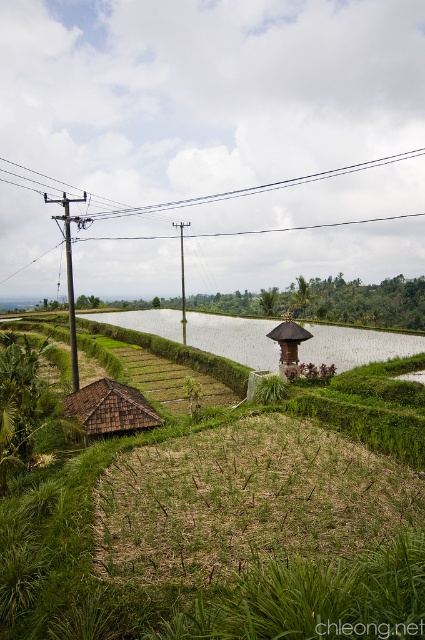
You are standing at the edge of the dry soil in the foreground of the rural landscape. You want to walk to the white smooth water at center. According to the coordinates provided, in which direction should you move relative to your current position?

The white smooth water at center is located at coordinates point (354, 346). Since you are at the edge of the dry soil in the foreground, you should move forward towards the center of the image to reach it.

You are a farmer planning to install a new fence. You have a black wire at upper center and a brown wooden hut at center in your view. Which object appears larger in the image?

The black wire at upper center appears larger than the brown wooden hut at center in the image.